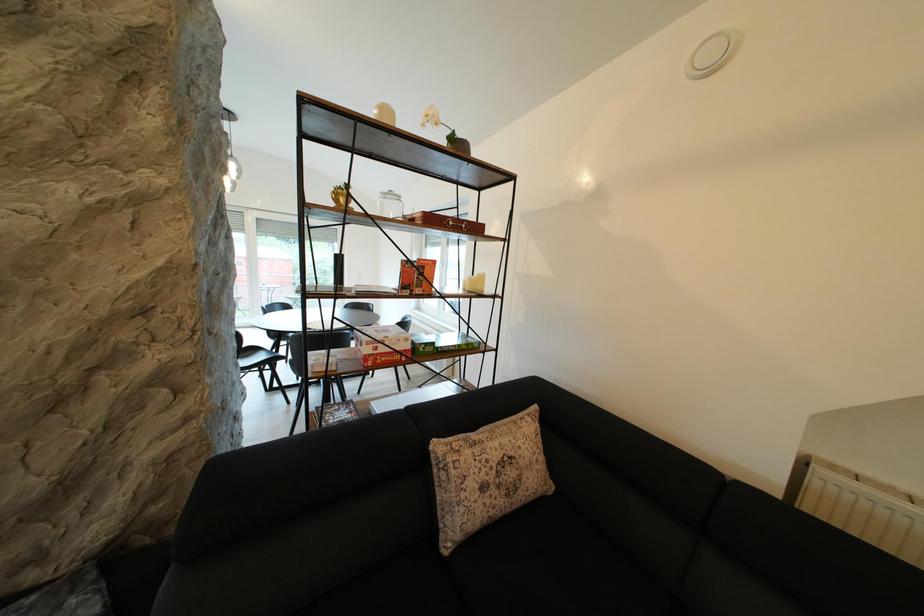
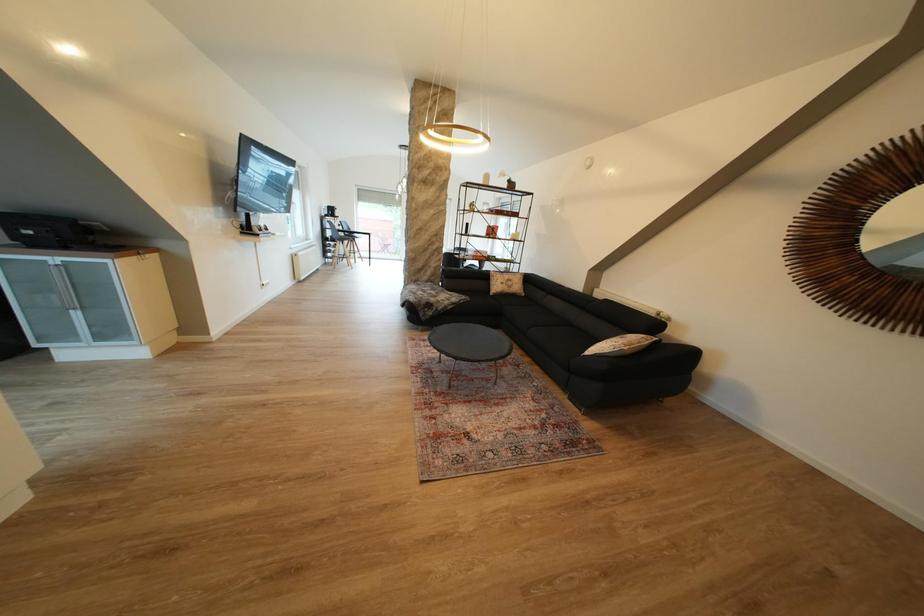
Question: Which direction would the cameraman need to move to produce the second image? Reply with the corresponding letter.

Choices:
 (A) Left
 (B) Right
 (C) Forward
 (D) Backward

Answer: (D)